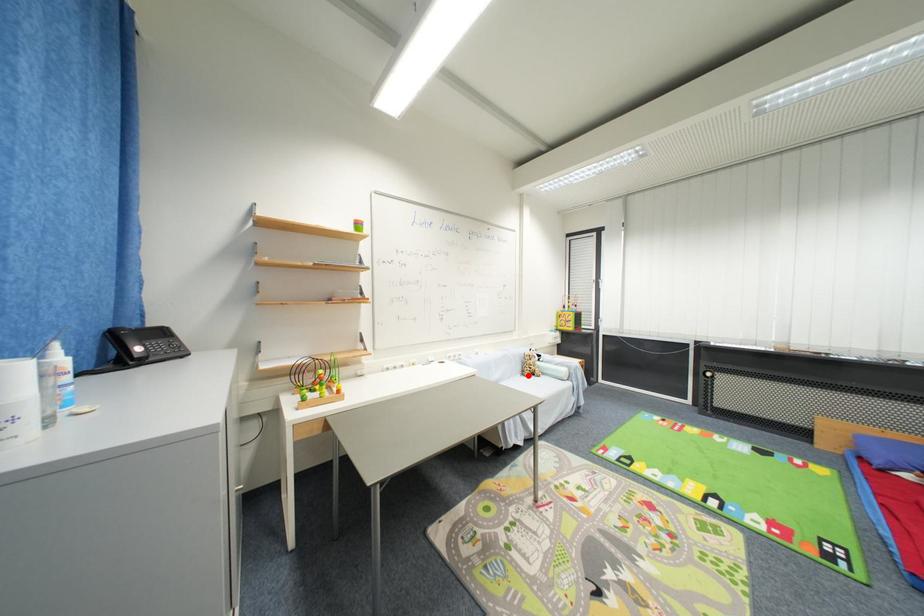
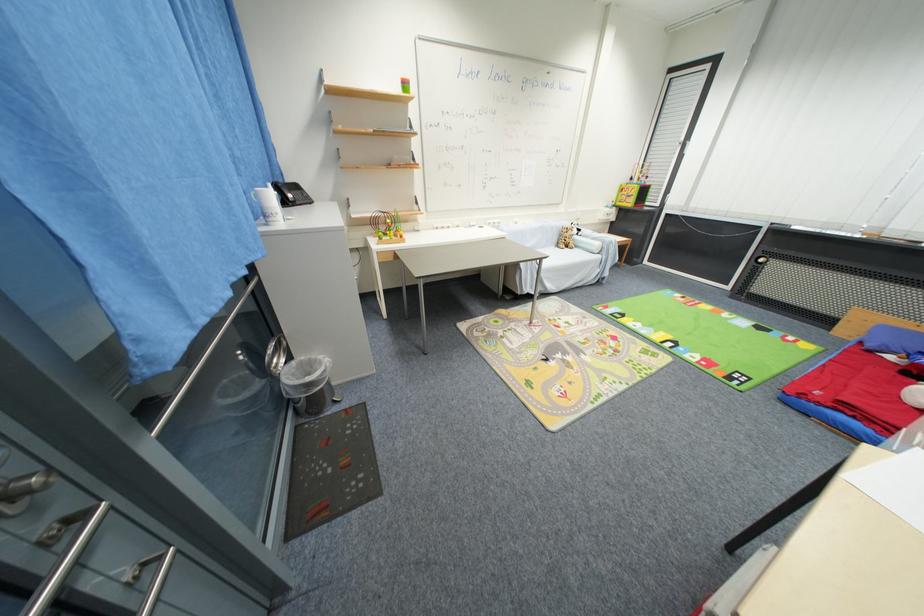
Where in the second image is the point corresponding to the highlighted location from the first image?

(563, 246)